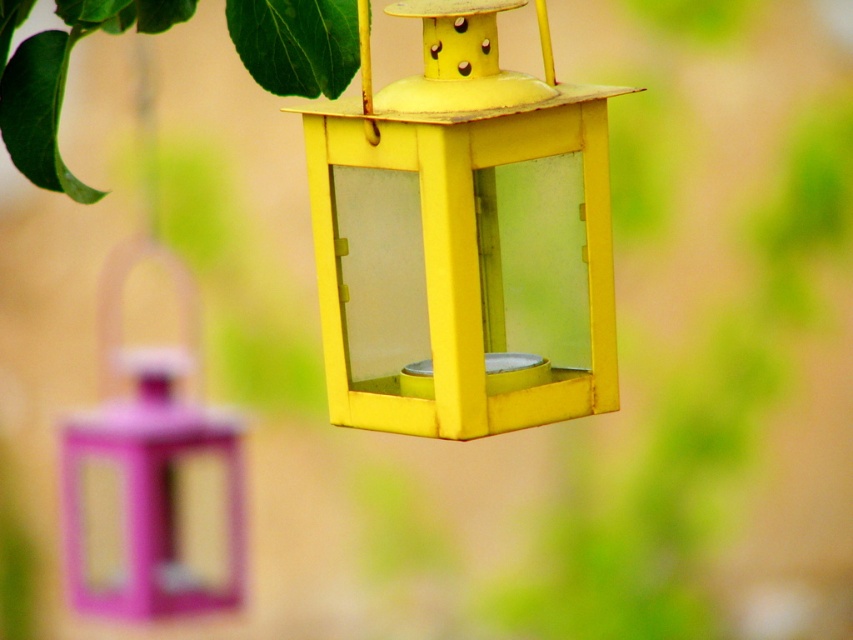
Does yellow matte lantern at center appear over purple matte bird feeder at left?

Indeed, yellow matte lantern at center is positioned over purple matte bird feeder at left.

Is the position of yellow matte lantern at center less distant than that of purple matte bird feeder at left?

That is True.

Locate an element on the screen. The height and width of the screenshot is (640, 853). yellow matte lantern at center is located at coordinates (463, 237).

At what (x,y) coordinates should I click in order to perform the action: click on yellow matte lantern at center. Please return your answer as a coordinate pair (x, y). Looking at the image, I should click on pyautogui.click(x=463, y=237).

Does purple matte bird feeder at left appear on the right side of green matte leaf at upper left?

No, purple matte bird feeder at left is not to the right of green matte leaf at upper left.

Does purple matte bird feeder at left have a larger size compared to green matte leaf at upper left?

Indeed, purple matte bird feeder at left has a larger size compared to green matte leaf at upper left.

This screenshot has width=853, height=640. Find the location of `purple matte bird feeder at left`. purple matte bird feeder at left is located at coordinates (149, 465).

Find the location of a particular element. The width and height of the screenshot is (853, 640). purple matte bird feeder at left is located at coordinates (149, 465).

Is yellow matte lantern at center in front of green matte leaf at upper left?

Yes, yellow matte lantern at center is closer to the viewer.

Is yellow matte lantern at center bigger than green matte leaf at upper left?

Indeed, yellow matte lantern at center has a larger size compared to green matte leaf at upper left.

In the scene shown: Who is more forward, (573,122) or (39,77)?

Point (573,122) is more forward.

At what (x,y) coordinates should I click in order to perform the action: click on yellow matte lantern at center. Please return your answer as a coordinate pair (x, y). This screenshot has width=853, height=640. Looking at the image, I should click on (463, 237).